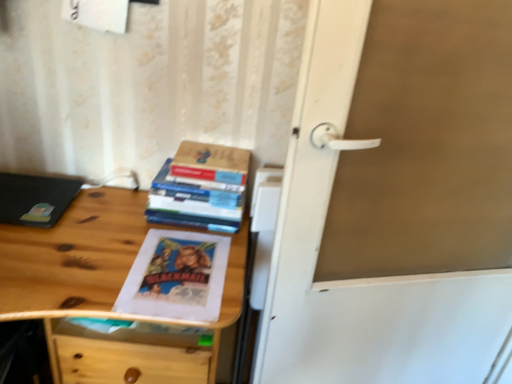
Locate an element on the screen. Image resolution: width=512 pixels, height=384 pixels. free location in front of hardcover books at center is located at coordinates (178, 252).